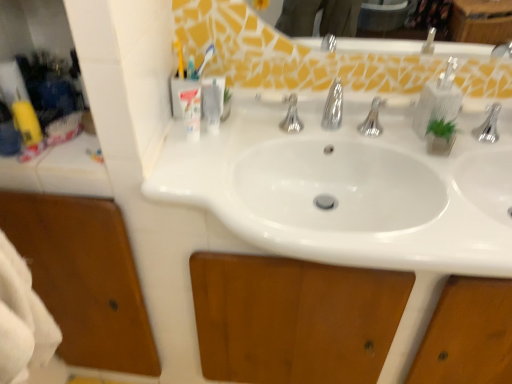
Question: Is translucent plastic toothbrush at upper center taller or shorter than clear plastic soap dispenser at upper center, placed as the first toiletry when sorted from right to left?

Choices:
 (A) tall
 (B) short

Answer: (B)

Question: From a real-world perspective, is translucent plastic toothbrush at upper center positioned above or below clear plastic soap dispenser at upper center, placed as the first toiletry when sorted from right to left?

Choices:
 (A) above
 (B) below

Answer: (A)

Question: Which is farther from the translucent plastic toothbrush at upper center?

Choices:
 (A) translucent plastic toothbrush holder at upper left, the 1th toiletry viewed from the left
 (B) clear plastic soap dispenser at upper center, placed as the first toiletry when sorted from right to left
 (C) clear plastic soap dispenser at upper right

Answer: (C)

Question: Which of these objects is positioned closest to the translucent plastic toothbrush holder at upper left, the 1th toiletry viewed from the left?

Choices:
 (A) clear plastic soap dispenser at upper right
 (B) clear plastic soap dispenser at upper center, the 2th toiletry positioned from the left
 (C) translucent plastic toothbrush at upper center

Answer: (B)